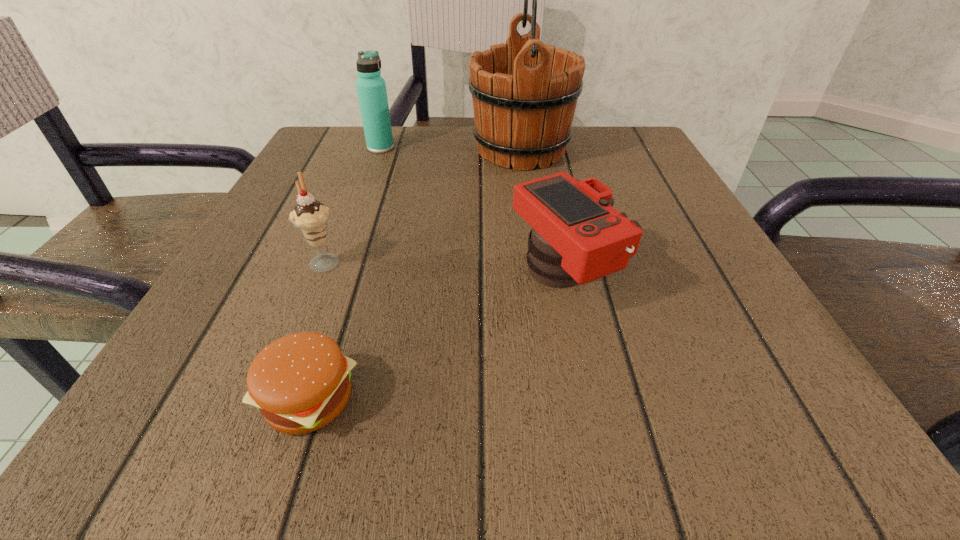
Where is `vacant area at the near edge of the desktop`? This screenshot has height=540, width=960. vacant area at the near edge of the desktop is located at coordinates (553, 382).

This screenshot has height=540, width=960. Identify the location of free space at the left edge of the desktop. (259, 314).

Locate an element on the screen. The width and height of the screenshot is (960, 540). vacant space at the right edge is located at coordinates (645, 317).

In the image, there is a desktop. Identify the location of blank space at the far left corner. (344, 134).

In the image, there is a desktop. At what (x,y) coordinates should I click in order to perform the action: click on vacant region at the far right corner. Please return your answer as a coordinate pair (x, y). This screenshot has width=960, height=540. Looking at the image, I should click on (644, 158).

Identify the location of vacant space at the near right corner. This screenshot has height=540, width=960. (765, 389).

Find the location of a particular element. vacant area that lies between the wine bucket and the thermos bottle is located at coordinates (451, 148).

In order to click on free spot between the fourth shortest object and the camera in this screenshot , I will do `click(472, 212)`.

Where is `free space between the wine bucket and the nearest object`? free space between the wine bucket and the nearest object is located at coordinates (415, 274).

Locate an element on the screen. This screenshot has width=960, height=540. vacant space that is in between the camera and the hamburger is located at coordinates (436, 338).